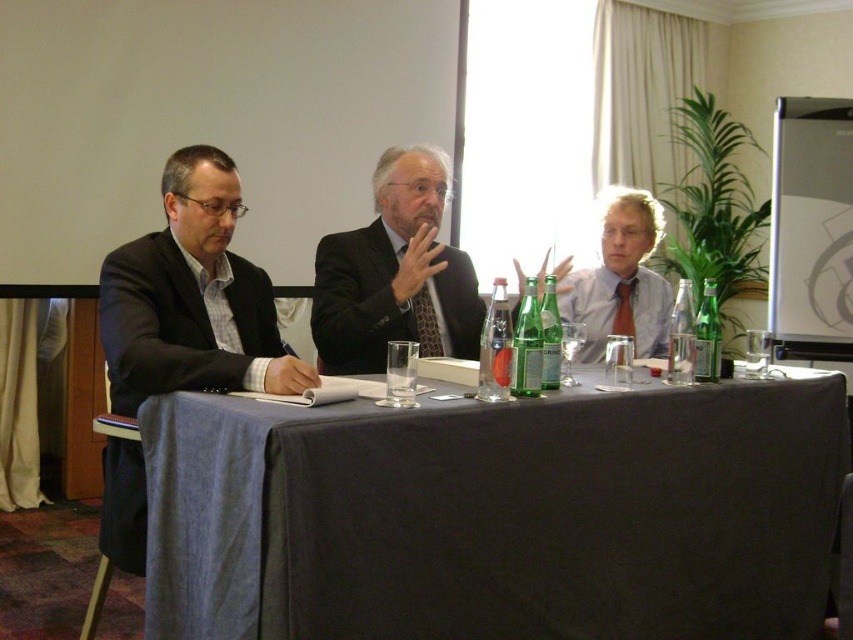
Does black fabric table at center appear over matte black shirt at center?

Incorrect, black fabric table at center is not positioned above matte black shirt at center.

Who is positioned more to the left, black fabric table at center or matte black shirt at center?

black fabric table at center

Locate an element on the screen. This screenshot has height=640, width=853. black fabric table at center is located at coordinates (498, 515).

The height and width of the screenshot is (640, 853). What are the coordinates of `black fabric table at center` in the screenshot? It's located at (498, 515).